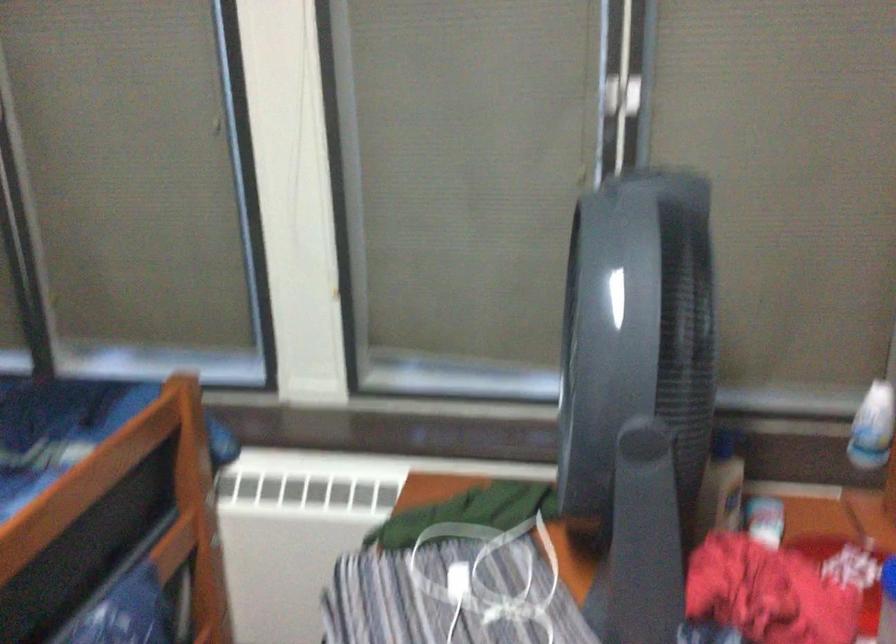
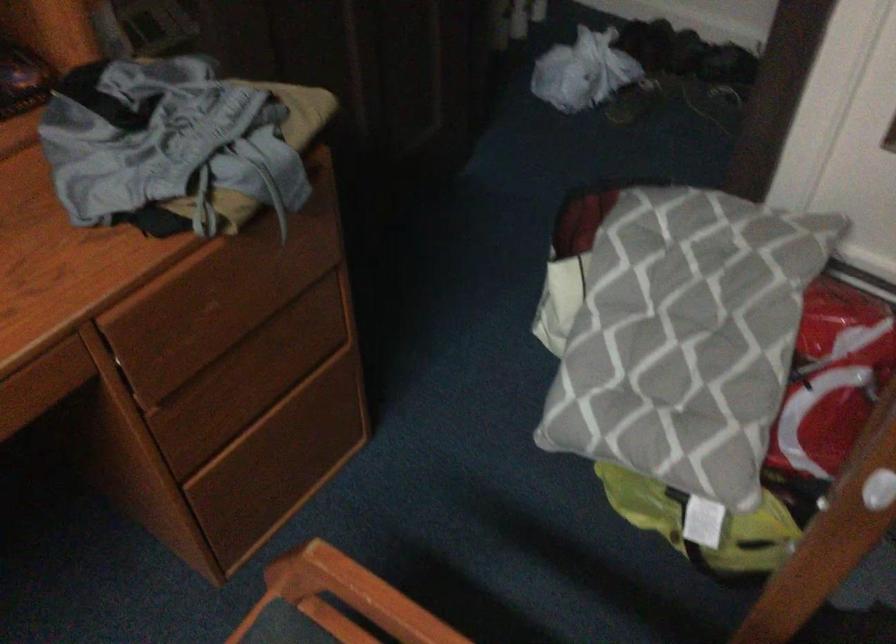
The images are taken continuously from a first-person perspective. In which direction is your viewpoint rotating?

The camera's rotation is toward right-down.